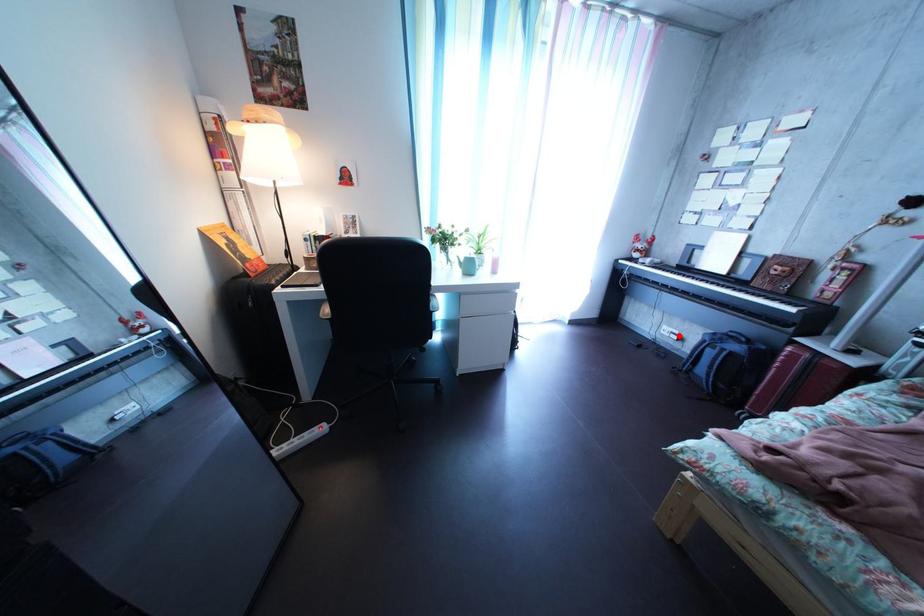
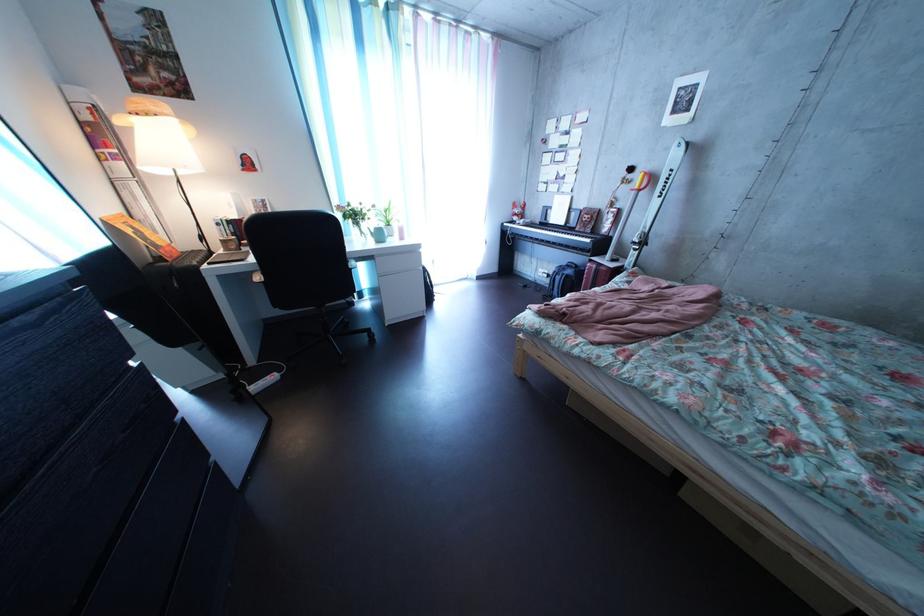
The point at the highlighted location is marked in the first image. Where is the corresponding point in the second image?

(554, 278)